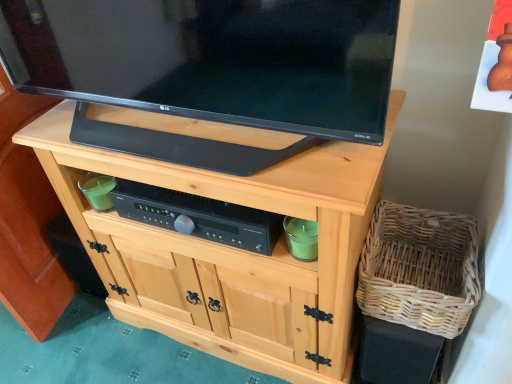
Question: Considering the relative sizes of woven natural basket at lower right and black plastic control at center in the image provided, is woven natural basket at lower right wider than black plastic control at center?

Choices:
 (A) yes
 (B) no

Answer: (A)

Question: Is woven natural basket at lower right touching black plastic control at center?

Choices:
 (A) no
 (B) yes

Answer: (A)

Question: From a real-world perspective, is woven natural basket at lower right on black plastic control at center?

Choices:
 (A) no
 (B) yes

Answer: (A)

Question: Does woven natural basket at lower right have a lesser width compared to black plastic control at center?

Choices:
 (A) yes
 (B) no

Answer: (B)

Question: Does woven natural basket at lower right have a lesser height compared to black plastic control at center?

Choices:
 (A) yes
 (B) no

Answer: (B)

Question: Is woven natural basket at lower right to the left or to the right of black glossy tv at upper center in the image?

Choices:
 (A) left
 (B) right

Answer: (B)

Question: Is point (445, 221) closer or farther from the camera than point (3, 1)?

Choices:
 (A) farther
 (B) closer

Answer: (A)

Question: From a real-world perspective, is woven natural basket at lower right physically located above or below black glossy tv at upper center?

Choices:
 (A) above
 (B) below

Answer: (B)

Question: Is woven natural basket at lower right taller or shorter than black glossy tv at upper center?

Choices:
 (A) tall
 (B) short

Answer: (B)

Question: Based on their sizes in the image, would you say natural wood cabinet at center is bigger or smaller than woven natural basket at lower right?

Choices:
 (A) small
 (B) big

Answer: (B)

Question: Considering the relative positions of natural wood cabinet at center and woven natural basket at lower right in the image provided, is natural wood cabinet at center to the left or to the right of woven natural basket at lower right?

Choices:
 (A) right
 (B) left

Answer: (B)

Question: From a real-world perspective, is natural wood cabinet at center positioned above or below woven natural basket at lower right?

Choices:
 (A) below
 (B) above

Answer: (A)

Question: Is natural wood cabinet at center wider or thinner than woven natural basket at lower right?

Choices:
 (A) wide
 (B) thin

Answer: (A)

Question: Would you say black plastic control at center is inside or outside black glossy tv at upper center?

Choices:
 (A) inside
 (B) outside

Answer: (B)

Question: Looking at the image, does black plastic control at center seem bigger or smaller compared to black glossy tv at upper center?

Choices:
 (A) big
 (B) small

Answer: (B)